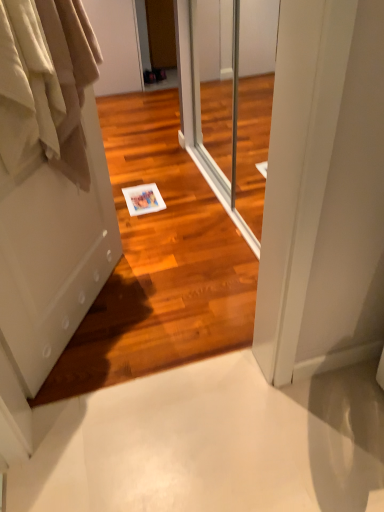
Where is `vacant area in front of white matte door at left`? Image resolution: width=384 pixels, height=512 pixels. vacant area in front of white matte door at left is located at coordinates (97, 353).